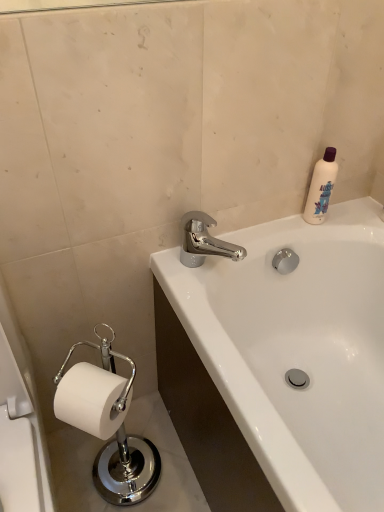
Question: Is white paper at lower left completely or partially inside white plastic bottle at upper right?

Choices:
 (A) yes
 (B) no

Answer: (B)

Question: Considering the relative sizes of white plastic bottle at upper right and white paper at lower left in the image provided, is white plastic bottle at upper right bigger than white paper at lower left?

Choices:
 (A) yes
 (B) no

Answer: (B)

Question: Is white plastic bottle at upper right aimed at white paper at lower left?

Choices:
 (A) yes
 (B) no

Answer: (B)

Question: Does white plastic bottle at upper right have a lesser width compared to white paper at lower left?

Choices:
 (A) yes
 (B) no

Answer: (A)

Question: Would you say white plastic bottle at upper right is a long distance from white paper at lower left?

Choices:
 (A) yes
 (B) no

Answer: (B)

Question: Is point (332, 174) positioned closer to the camera than point (254, 284)?

Choices:
 (A) closer
 (B) farther

Answer: (A)

Question: Is white plastic bottle at upper right wider or thinner than white glossy bathtub at upper right?

Choices:
 (A) thin
 (B) wide

Answer: (A)

Question: Is white plastic bottle at upper right taller or shorter than white glossy bathtub at upper right?

Choices:
 (A) short
 (B) tall

Answer: (A)

Question: From the image's perspective, is white plastic bottle at upper right located above or below white glossy bathtub at upper right?

Choices:
 (A) above
 (B) below

Answer: (A)

Question: Is chrome metallic faucet at upper center taller or shorter than white plastic bottle at upper right?

Choices:
 (A) tall
 (B) short

Answer: (B)

Question: Visually, is chrome metallic faucet at upper center positioned to the left or to the right of white plastic bottle at upper right?

Choices:
 (A) right
 (B) left

Answer: (B)

Question: Is chrome metallic faucet at upper center inside the boundaries of white plastic bottle at upper right, or outside?

Choices:
 (A) inside
 (B) outside

Answer: (B)

Question: From a real-world perspective, is chrome metallic faucet at upper center positioned above or below white plastic bottle at upper right?

Choices:
 (A) above
 (B) below

Answer: (B)

Question: From the image's perspective, is white glossy bathtub at upper right positioned above or below chrome metallic faucet at upper center?

Choices:
 (A) below
 (B) above

Answer: (A)

Question: From a real-world perspective, relative to chrome metallic faucet at upper center, is white glossy bathtub at upper right vertically above or below?

Choices:
 (A) below
 (B) above

Answer: (A)